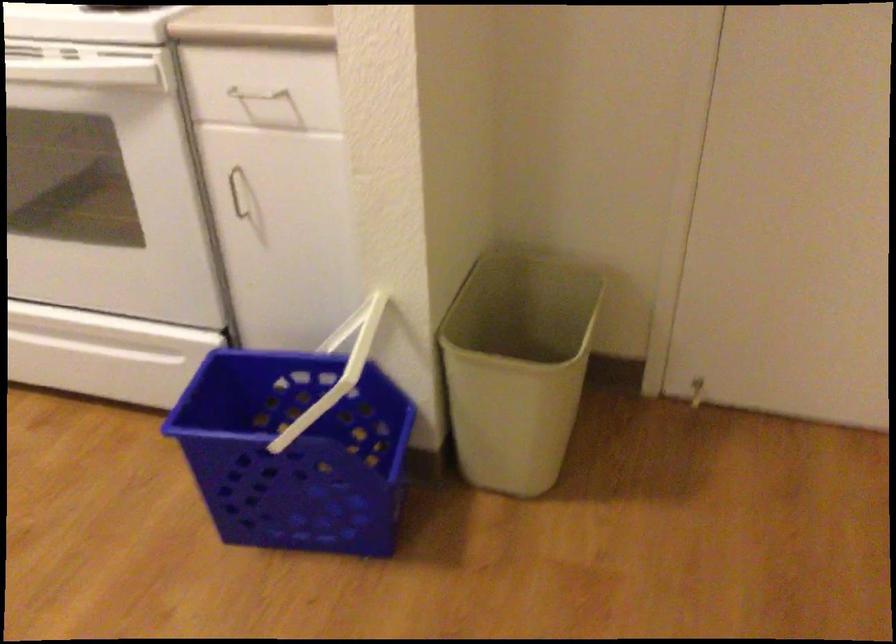
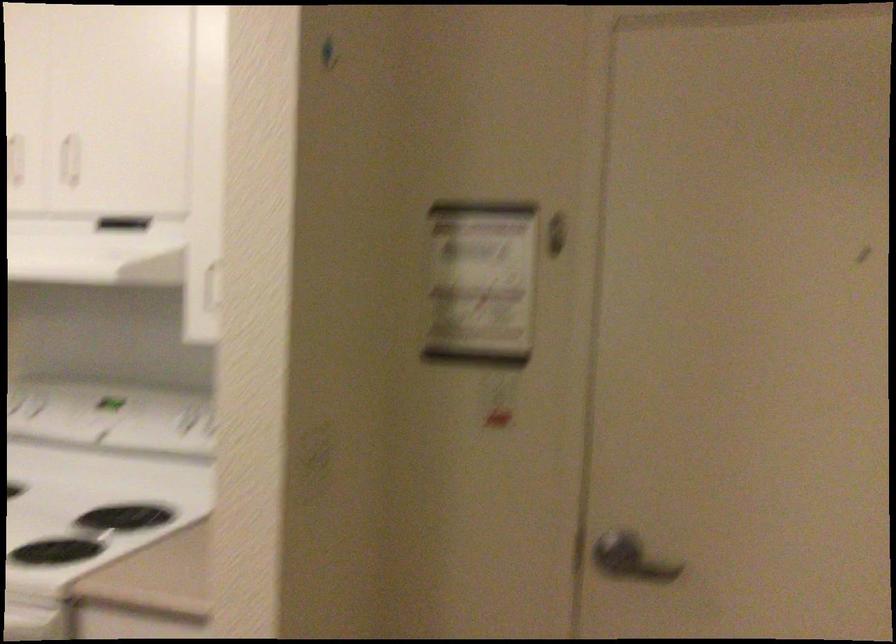
Question: Based on the continuous images, in which direction is the camera rotating? Reply with the corresponding letter.

Choices:
 (A) Left
 (B) Right
 (C) Up
 (D) Down

Answer: (C)